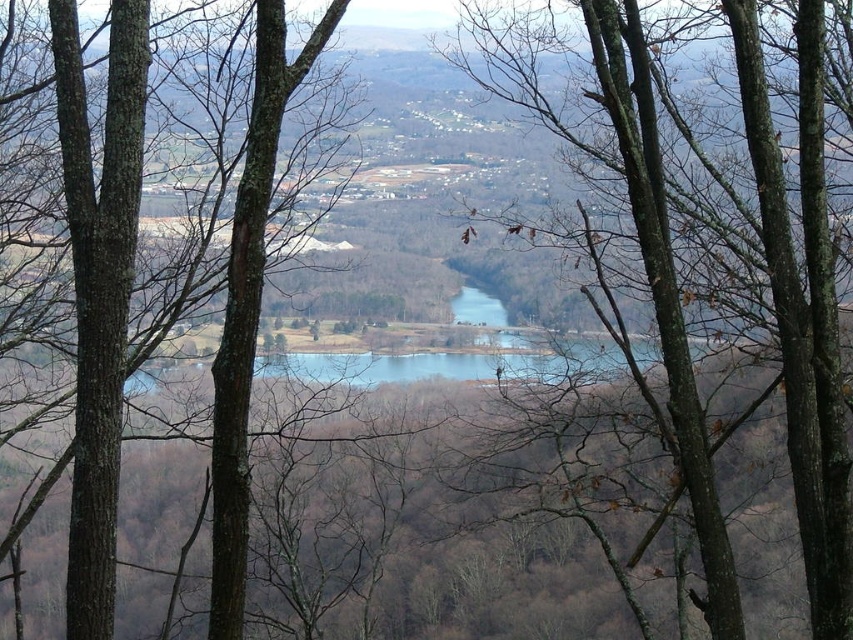
How much distance is there between brown rough bark tree at center and brown rough tree at left?

The distance of brown rough bark tree at center from brown rough tree at left is 5.80 meters.

Between brown rough bark tree at center and brown rough tree at left, which one appears on the right side from the viewer's perspective?

brown rough bark tree at center

Identify the location of brown rough bark tree at center. (712, 252).